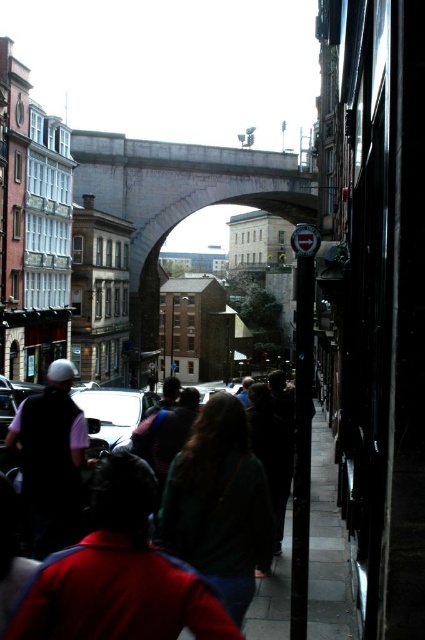
You are standing at the entrance of the alley and want to take a photo of the stone archway at center and the dark green sweater at center. Which object will appear larger in your photo?

The stone archway at center will appear larger in the photo because it is taller than the dark green sweater at center.

You are a photographer standing in the alleyway and want to capture both the stone archway at center and the shiny silver car at center in a single shot. Which object should you position closer to the left side of your camera frame to include both?

The stone archway at center is positioned on the right side of the shiny silver car at center. To include both in the single shot, you should position the shiny silver car at center closer to the left side of your camera frame so that the stone archway at center naturally falls on its right side within the frame.

You are a photographer standing in the alleyway and want to capture both the stone archway at center and the shiny silver car at center in the same frame. Which object should you focus on to ensure both are visible without moving your camera?

The stone archway at center is wider than the shiny silver car at center. To capture both in the same frame, focus on the stone archway at center since its greater width allows it to encompass the car within the shot.